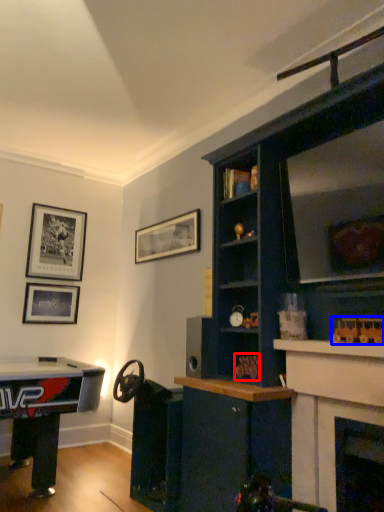
Question: Among these objects, which one is nearest to the camera, toy (highlighted by a red box) or toy (highlighted by a blue box)?

Choices:
 (A) toy
 (B) toy

Answer: (B)